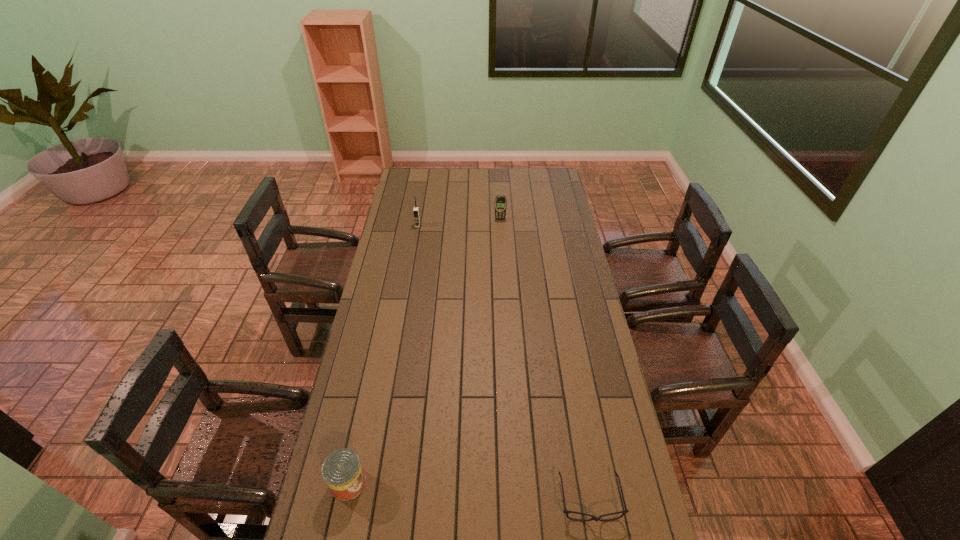
Locate which object is the second closest to the shortest object. Please provide its 2D coordinates. Your answer should be formatted as a tuple, i.e. [(x, y)], where the tuple contains the x and y coordinates of a point satisfying the conditions above.

[(500, 201)]